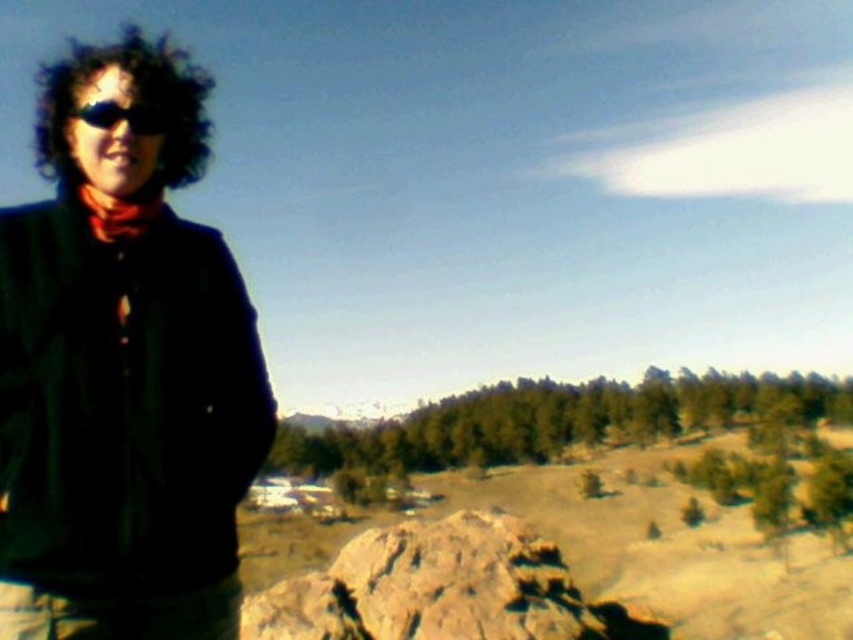
You are standing at the point marked as point (579, 612) in the image. You want to walk towards the snow capped mountains in the distance. Is the viewer in your path?

The point (579, 612) is 120.00 feet away from the viewer. Since you are standing at the point and want to walk towards the snow capped mountains, the viewer is not in your path as they are behind you.

Based on the photo, you are a fashion designer analyzing the outfit of a person in the image. The person is wearing a dark green fabric jacket at left and black matte sunglasses at left. Which item is taller?

The dark green fabric jacket at left is taller than the black matte sunglasses at left.